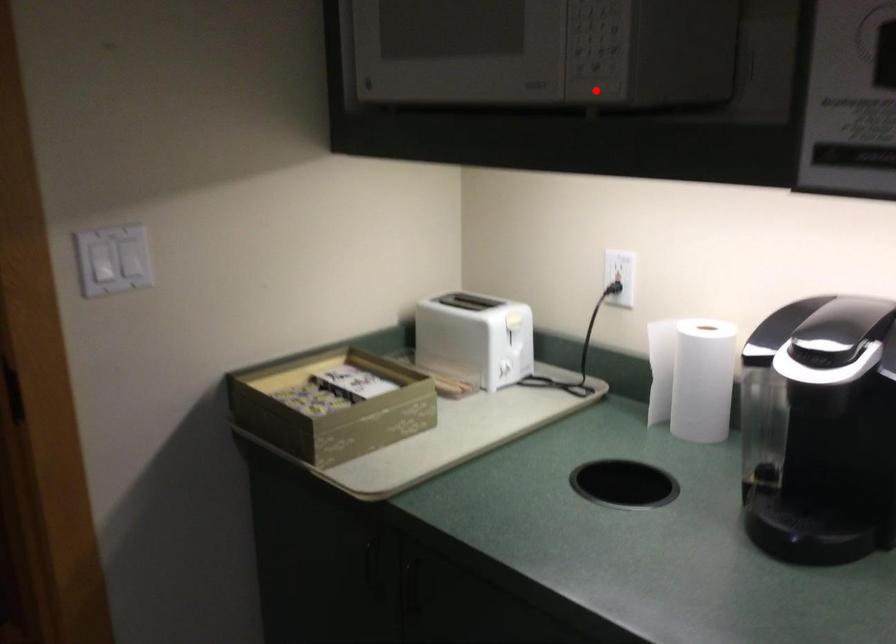
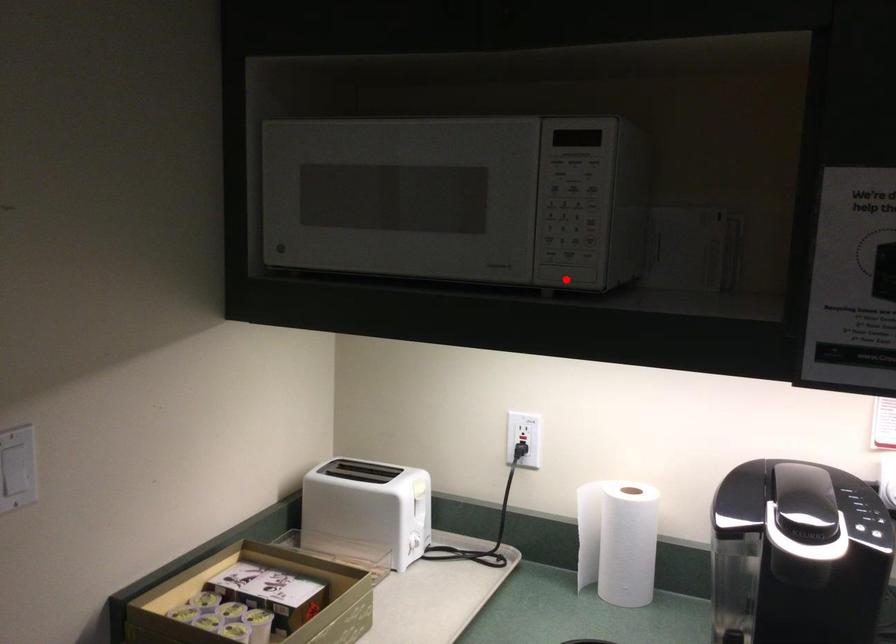
In the scene shown: I am providing you with two images of the same scene from different viewpoints. A red point is marked on the first image and another point is marked on the second image. Is the red point in image1 aligned with the point shown in image2?

Yes